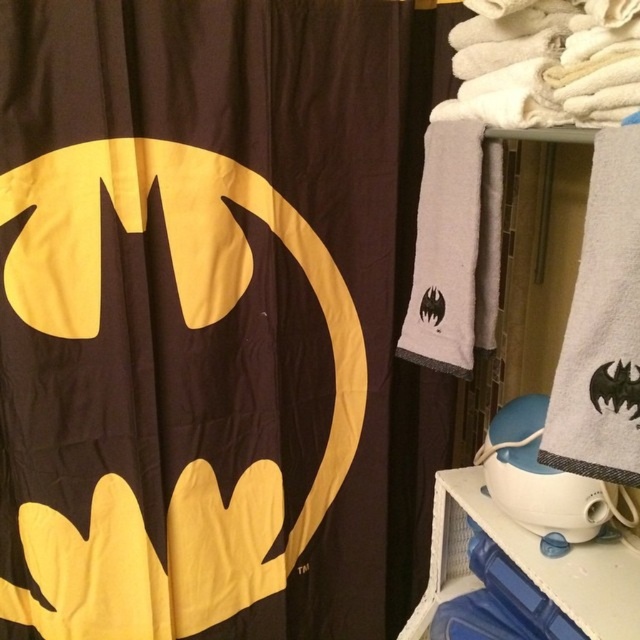
You are a guest in this Batman themed bathroom and want to place a Batman action figure on the white plastic shelf at lower right. However, you notice the matte black fabric batman logo at left is in the way. Can you move the action figure to the shelf without moving the logo?

The white plastic shelf at lower right is behind the matte black fabric batman logo at left, so you can move the action figure to the shelf by going around the logo since the shelf is positioned behind it.

You are a guest in this Batman themed bathroom. You need to place a Batman action figure that is 12 inches tall. The action figure must be placed on either the matte black fabric batman logo at left or the white plastic shelf at lower right. Which surface can accommodate the action figure based on their heights?

The matte black fabric batman logo at left has a greater height compared to the white plastic shelf at lower right. Therefore, the action figure can be placed on the matte black fabric batman logo at left since it is taller and can support the 12 inch height requirement.

You are a Batman fan visiting this bathroom and want to place a 18 inch long Batman figurine between the matte black fabric batman logo at left and the white plastic shelf at lower right. Is there enough space for the figurine?

The distance between the matte black fabric batman logo at left and the white plastic shelf at lower right is 21.28 inches, which is more than enough to place an 18 inch long Batman figurine between them.